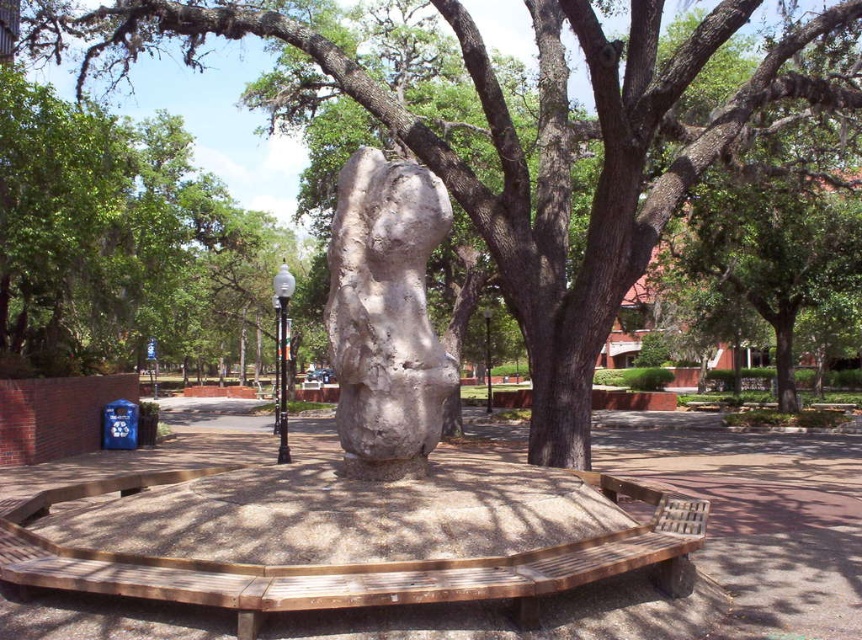
You are planning to place a small potted plant between the wooden bench at center and the white stone sculpture at center. Based on their sizes, which object should the plant be closer to?

The wooden bench at center is larger than the white stone sculpture at center, so the plant should be placed closer to the white stone sculpture at center to maintain balance.